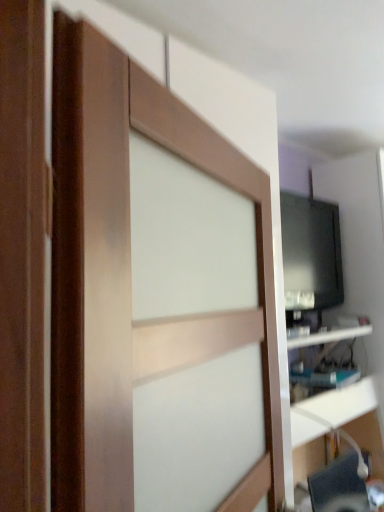
Find the location of `gray fabric computer chair at lower right`. gray fabric computer chair at lower right is located at coordinates (339, 487).

In order to face gray fabric computer chair at lower right, should I rotate leftwards or rightwards?

You should rotate right by 22.641 degrees.

At what (x,y) coordinates should I click in order to perform the action: click on black glossy tv at upper right. Please return your answer as a coordinate pair (x, y). This screenshot has height=512, width=384. Looking at the image, I should click on (361, 271).

This screenshot has height=512, width=384. What do you see at coordinates (328, 339) in the screenshot? I see `white glossy shelf at right` at bounding box center [328, 339].

The image size is (384, 512). What do you see at coordinates (126, 264) in the screenshot?
I see `wooden barn door at center` at bounding box center [126, 264].

Where is `gray fabric computer chair at lower right`? The height and width of the screenshot is (512, 384). gray fabric computer chair at lower right is located at coordinates (339, 487).

Which is in front, point (96, 492) or point (378, 374)?

Positioned in front is point (96, 492).

From a real-world perspective, is wooden barn door at center under black glossy tv at upper right?

Actually, wooden barn door at center is physically above black glossy tv at upper right in the real world.

Which of these two, wooden barn door at center or black glossy tv at upper right, is thinner?

Answer: wooden barn door at center.

Is wooden barn door at center next to black glossy tv at upper right?

No, wooden barn door at center is not in contact with black glossy tv at upper right.

Looking at their sizes, would you say gray fabric computer chair at lower right is wider or thinner than white glossy shelf at right?

Considering their sizes, gray fabric computer chair at lower right looks slimmer than white glossy shelf at right.

What's the angular difference between gray fabric computer chair at lower right and white glossy shelf at right's facing directions?

The angle between the facing direction of gray fabric computer chair at lower right and the facing direction of white glossy shelf at right is 0.0879 degrees.

Looking at this image, between gray fabric computer chair at lower right and white glossy shelf at right, which one appears on the left side from the viewer's perspective?

From the viewer's perspective, white glossy shelf at right appears more on the left side.

Looking at this image, from the image's perspective, is gray fabric computer chair at lower right positioned above or below white glossy shelf at right?

gray fabric computer chair at lower right is situated lower than white glossy shelf at right in the image.

Is wooden barn door at center inside the boundaries of white glossy shelf at right, or outside?

wooden barn door at center is spatially situated outside white glossy shelf at right.

Is wooden barn door at center positioned far away from white glossy shelf at right?

No, wooden barn door at center is not far from white glossy shelf at right.

Consider the image. Between wooden barn door at center and white glossy shelf at right, which one has smaller width?

With smaller width is wooden barn door at center.

From the image's perspective, is wooden barn door at center under white glossy shelf at right?

No, from the image's perspective, wooden barn door at center is not beneath white glossy shelf at right.

Consider the image. How many degrees apart are the facing directions of white glossy shelf at right and gray fabric computer chair at lower right?

0.0879 degrees.

Would you say white glossy shelf at right is outside gray fabric computer chair at lower right?

That's correct, white glossy shelf at right is outside of gray fabric computer chair at lower right.

From the image's perspective, between white glossy shelf at right and gray fabric computer chair at lower right, which one is located above?

white glossy shelf at right.

I want to click on shelf to the left of gray fabric computer chair at lower right, so click(328, 339).

From the image's perspective, would you say white glossy shelf at right is positioned over wooden barn door at center?

Actually, white glossy shelf at right appears below wooden barn door at center in the image.

Is white glossy shelf at right positioned with its back to wooden barn door at center?

white glossy shelf at right is not turned away from wooden barn door at center.

From the picture: Does white glossy shelf at right appear on the right side of wooden barn door at center?

Correct, you'll find white glossy shelf at right to the right of wooden barn door at center.

Based on the photo, is black glossy tv at upper right facing away from white glossy shelf at right?

black glossy tv at upper right is not turned away from white glossy shelf at right.

Considering the sizes of black glossy tv at upper right and white glossy shelf at right in the image, is black glossy tv at upper right wider or thinner than white glossy shelf at right?

In the image, black glossy tv at upper right appears to be wider than white glossy shelf at right.

Is black glossy tv at upper right behind white glossy shelf at right?

Yes, it is behind white glossy shelf at right.

Does point (375, 328) come closer to viewer compared to point (326, 380)?

No, (375, 328) is behind (326, 380).

Could you tell me if black glossy monitor at right is facing white glossy shelf at right?

No, black glossy monitor at right is not facing towards white glossy shelf at right.

In order to click on computer monitor above the white glossy shelf at right (from a real-world perspective) in this screenshot , I will do `click(310, 254)`.

Are black glossy monitor at right and white glossy shelf at right located far from each other?

black glossy monitor at right is actually quite close to white glossy shelf at right.

From the picture: Is the position of black glossy monitor at right more distant than that of white glossy shelf at right?

Yes, it is behind white glossy shelf at right.

You are a GUI agent. You are given a task and a screenshot of the screen. Output one action in this format:
    pyautogui.click(x=<x>, y=<y>)
    Task: Click on the barn door above the black glossy tv at upper right (from the image's perspective)
    The image size is (384, 512).
    Given the screenshot: What is the action you would take?
    pyautogui.click(x=126, y=264)

You are a GUI agent. You are given a task and a screenshot of the screen. Output one action in this format:
    pyautogui.click(x=<x>, y=<y>)
    Task: Click on the shelf above the gray fabric computer chair at lower right (from a real-world perspective)
    This screenshot has width=384, height=512.
    Given the screenshot: What is the action you would take?
    pyautogui.click(x=328, y=339)

Considering their positions, is gray fabric computer chair at lower right positioned further to white glossy shelf at right than wooden barn door at center?

The object further to white glossy shelf at right is wooden barn door at center.

Considering their positions, is wooden barn door at center positioned further to white glossy shelf at right than gray fabric computer chair at lower right?

The object further to white glossy shelf at right is wooden barn door at center.

From the image, which object appears to be nearer to black glossy tv at upper right, black glossy monitor at right or white glossy shelf at right?

The object closer to black glossy tv at upper right is black glossy monitor at right.

When comparing their distances from gray fabric computer chair at lower right, does black glossy tv at upper right or black glossy monitor at right seem further?

black glossy monitor at right is further to gray fabric computer chair at lower right.

Which object lies further to the anchor point black glossy tv at upper right, wooden barn door at center or black glossy monitor at right?

Based on the image, wooden barn door at center appears to be further to black glossy tv at upper right.

Based on their spatial positions, is black glossy tv at upper right or black glossy monitor at right further from white glossy shelf at right?

Based on the image, black glossy tv at upper right appears to be further to white glossy shelf at right.

When comparing their distances from black glossy monitor at right, does wooden barn door at center or gray fabric computer chair at lower right seem further?

wooden barn door at center.

Based on their spatial positions, is gray fabric computer chair at lower right or black glossy monitor at right closer to white glossy shelf at right?

black glossy monitor at right is positioned closer to the anchor white glossy shelf at right.

The height and width of the screenshot is (512, 384). In order to click on shelf located between wooden barn door at center and black glossy tv at upper right in the depth direction in this screenshot , I will do `click(328, 339)`.

Find the location of a particular element. Image resolution: width=384 pixels, height=512 pixels. computer chair between wooden barn door at center and black glossy monitor at right from front to back is located at coordinates coord(339,487).

You are a GUI agent. You are given a task and a screenshot of the screen. Output one action in this format:
    pyautogui.click(x=<x>, y=<y>)
    Task: Click on the computer chair between wooden barn door at center and black glossy tv at upper right in the front-back direction
    This screenshot has height=512, width=384.
    Given the screenshot: What is the action you would take?
    pyautogui.click(x=339, y=487)

You are a GUI agent. You are given a task and a screenshot of the screen. Output one action in this format:
    pyautogui.click(x=<x>, y=<y>)
    Task: Click on the shelf between black glossy monitor at right and gray fabric computer chair at lower right in the vertical direction
    
    Given the screenshot: What is the action you would take?
    pyautogui.click(x=328, y=339)